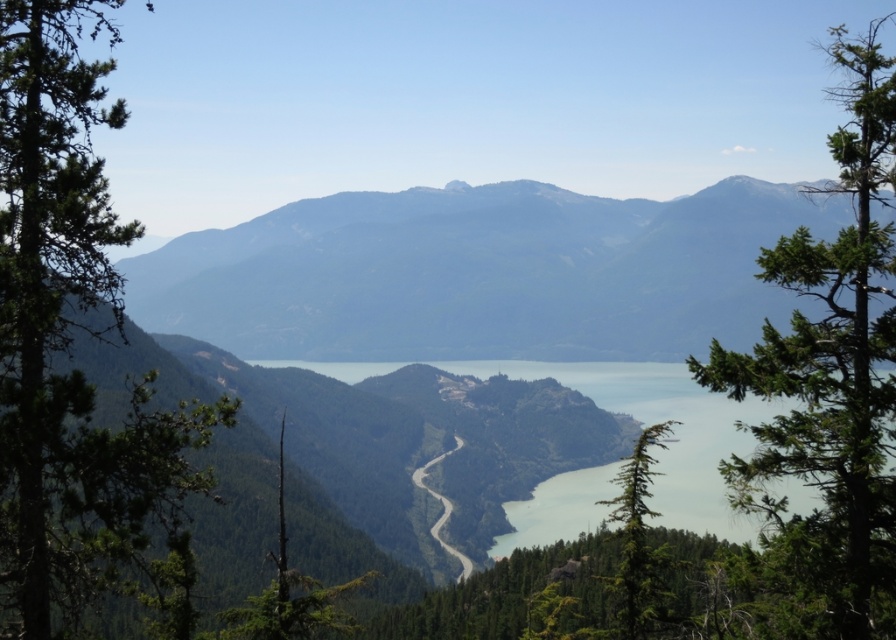
You are a hiker planning to take a photo of the gray rocky mountain at center from the winding road in the middle ground. Based on the coordinates provided, can you determine if the mountain will be fully visible in your photo when you stand at the edge of the road?

The gray rocky mountain at center is positioned at coordinates point (x=481, y=273), which means it is centrally located in the image. Since the winding road is in the middle ground and the mountain is at the center, the mountain will be fully visible in your photo when standing at the edge of the road.

You are a hiker who wants to take a photo of the gray rocky mountain at center and the green textured tree at lower right. Which object will appear larger in your camera viewfinder?

The gray rocky mountain at center will appear larger in your camera viewfinder because it is much taller than the green textured tree at lower right.

You are standing at the highest point in the mountain landscape and want to determine which of the two points, point (16, 326) or point (636, 621), is nearer to you. Based on the image, which point is closer?

Point (16, 326) is closer to the viewer than point (636, 621).